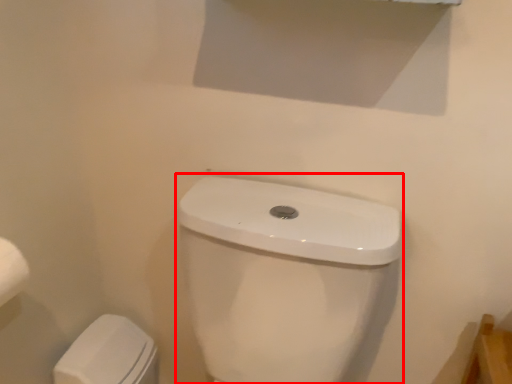
Question: In this image, where is sink (annotated by the red box) located relative to porcelain?

Choices:
 (A) left
 (B) right

Answer: (B)